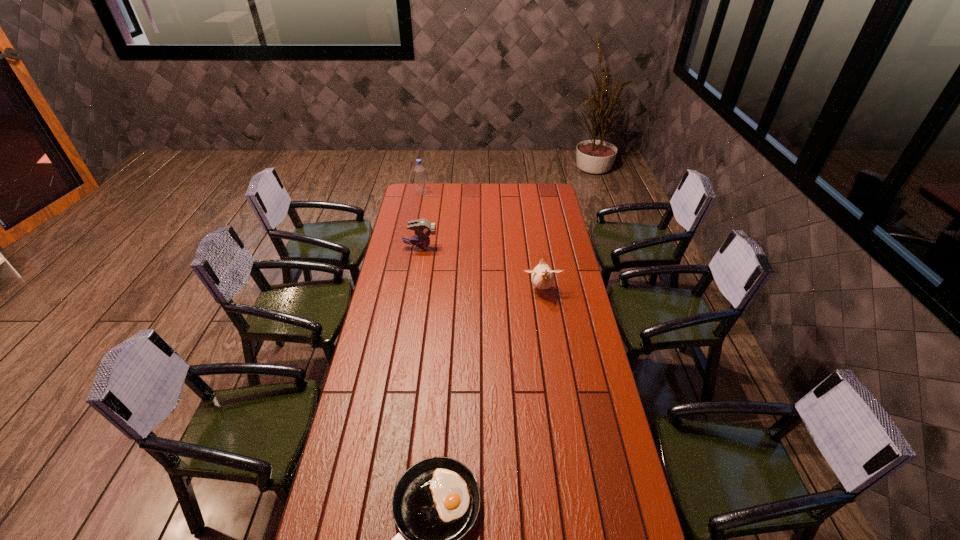
You are a GUI agent. You are given a task and a screenshot of the screen. Output one action in this format:
    pyautogui.click(x=<x>, y=<y>)
    Task: Click on the free spot between the right bird and the left bird
    Image resolution: width=960 pixels, height=540 pixels.
    Given the screenshot: What is the action you would take?
    pyautogui.click(x=481, y=269)

Where is `free point between the farthest object and the nearer bird`? The width and height of the screenshot is (960, 540). free point between the farthest object and the nearer bird is located at coordinates (482, 242).

What are the coordinates of `object that stands as the closest to the nearest object` in the screenshot? It's located at (542, 277).

This screenshot has height=540, width=960. I want to click on object that is the second nearest to the left bird, so click(x=420, y=180).